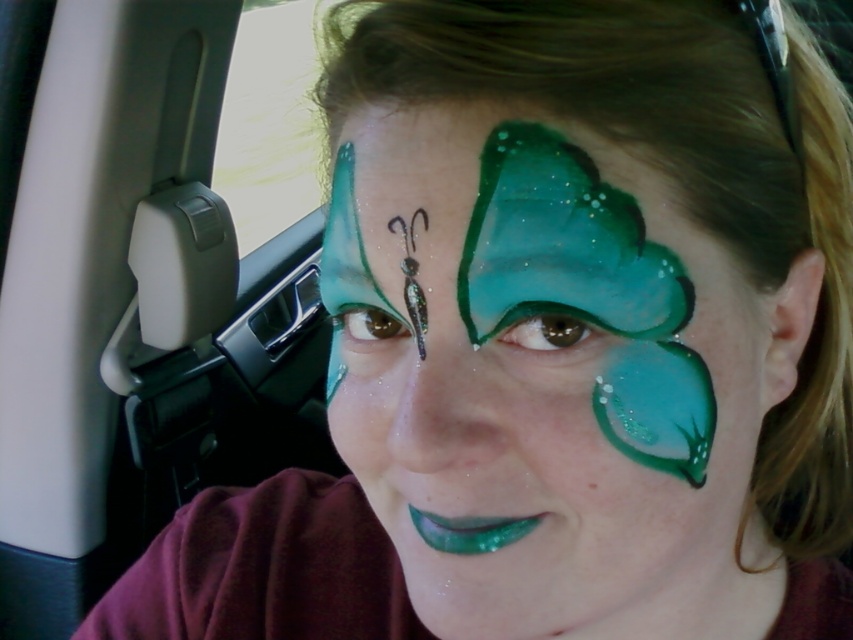
Question: In this image, where is shiny green paint at center located relative to transparent glass car window at upper left?

Choices:
 (A) above
 (B) below

Answer: (B)

Question: Does shiny green paint at center have a lesser width compared to transparent glass car window at upper left?

Choices:
 (A) yes
 (B) no

Answer: (A)

Question: Which of the following is the farthest from the observer?

Choices:
 (A) (747, 422)
 (B) (277, 163)

Answer: (B)

Question: In this image, where is shiny green paint at center located relative to transparent glass car window at upper left?

Choices:
 (A) above
 (B) below

Answer: (B)